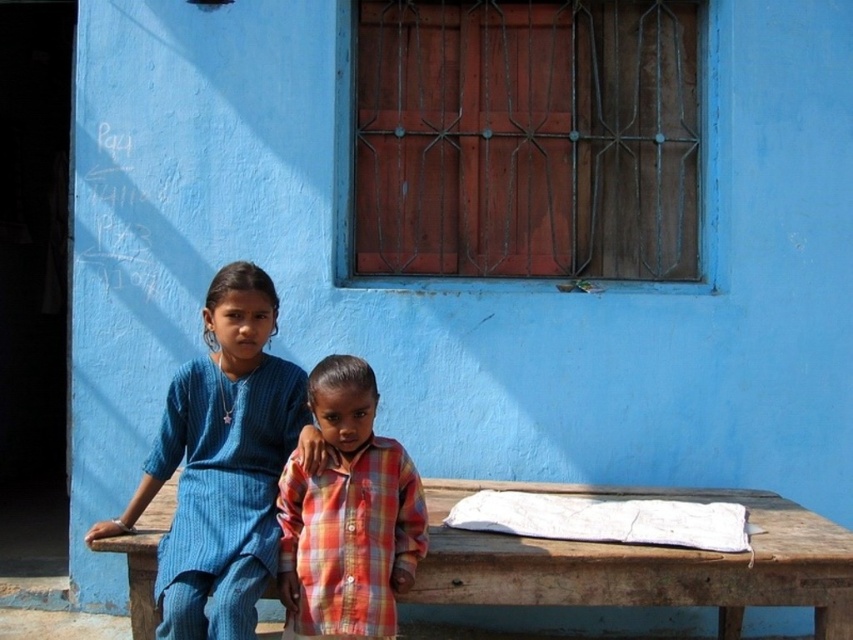
Looking at this image, you are standing in a park and see a wooden picnic table at lower center. Can you determine if the wooden picnic table at lower center is located to the left or right of the point at coordinates (643, 561)?

The wooden picnic table at lower center is located at the point at coordinates (643, 561), so it is exactly at that point and not to the left or right of it.

Please look at the image and locate the point at coordinates (223, 465). What object is located at this point?

The point at coordinates (223, 465) corresponds to the blue textured dress at center.

You are a photographer trying to capture a closeup of the blue textured dress at center and the plaid fabric shirt at center. Since the camera can only focus on one object at a time, which one should you focus on to ensure the other is still somewhat in focus?

The blue textured dress at center is in front of plaid fabric shirt at center. To ensure the plaid fabric shirt at center is somewhat in focus, focus on the blue textured dress at center since it is closer to the camera.